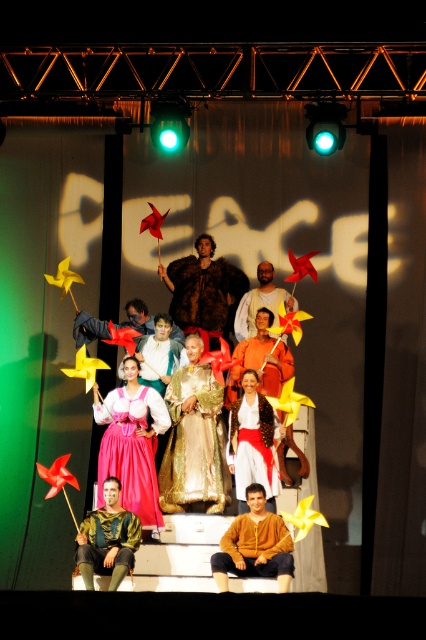
You are a stagehand adjusting the lighting for the performance. You notice two dresses at the center of the stage, the gold metallic dress at center and the white satin dress at center. Which dress requires more downward adjustment to ensure it doesn

The gold metallic dress at center is taller than the white satin dress at center, so it requires more downward adjustment to ensure proper lighting coverage.

You are a stagehand preparing to move the pink satin dress at center and the matte orange dress at center to the dressing room. The doorway you are using is 1.2 meters wide. Can both dresses fit through the doorway side by side without overlapping?

The pink satin dress at center is wider than the matte orange dress at center. Since the doorway is 1.2 meters wide, it depends on the combined width of both dresses. However, without specific measurements, we cannot confirm if they can fit side by side.

You are an audience member sitting in the front row of the theater. You see two performers wearing a gold metallic dress at center and a white satin dress at center. Which one is more to the left?

The gold metallic dress at center is more to the left side of the white satin dress at center.